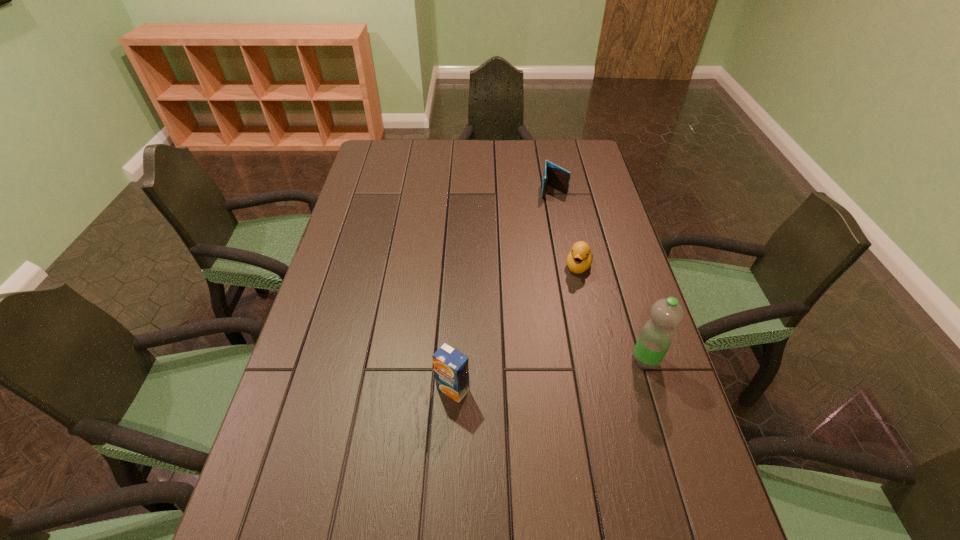
Identify the location of free space between the leftmost object and the wallet. Image resolution: width=960 pixels, height=540 pixels. (503, 290).

You are a GUI agent. You are given a task and a screenshot of the screen. Output one action in this format:
    pyautogui.click(x=<x>, y=<y>)
    Task: Click on the vacant region between the third nearest object and the wallet
    This screenshot has width=960, height=540.
    Given the screenshot: What is the action you would take?
    pyautogui.click(x=566, y=228)

Find the location of a particular element. The image size is (960, 540). object that stands as the third closest to the farthest object is located at coordinates (451, 368).

This screenshot has width=960, height=540. Identify the location of object that ranks as the closest to the rightmost object. (579, 259).

The image size is (960, 540). What are the coordinates of `vacant area that satisfies the following two spatial constraints: 1. on the front side of the farthest object; 2. on the left side of the duckling` in the screenshot? It's located at (568, 266).

At what (x,y) coordinates should I click in order to perform the action: click on vacant area in the image that satisfies the following two spatial constraints: 1. on the front side of the wallet; 2. on the right side of the rightmost object. Please return your answer as a coordinate pair (x, y). Looking at the image, I should click on (588, 360).